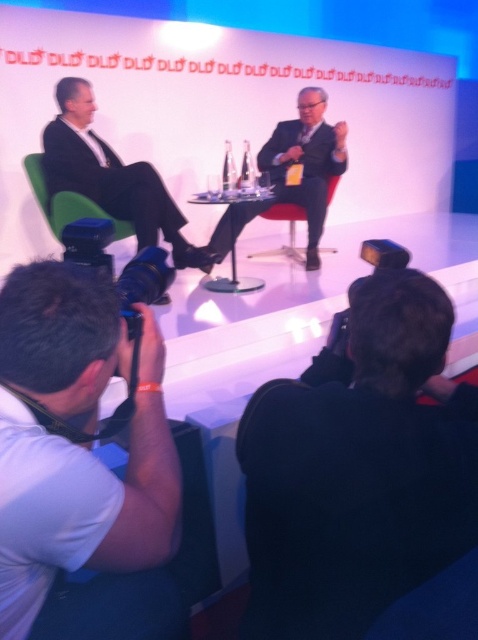
Is matte black suit at left bigger than red leather chair at center?

Correct, matte black suit at left is larger in size than red leather chair at center.

Between point (175, 225) and point (323, 250), which one is positioned in front?

Positioned in front is point (175, 225).

Does point (170, 240) come behind point (304, 260)?

No, it is in front of (304, 260).

I want to click on matte black suit at left, so click(x=111, y=177).

Between point (36, 353) and point (115, 240), which one is positioned behind?

Positioned behind is point (115, 240).

Who is taller, white fabric camera at lower left or green fabric chair at left?

white fabric camera at lower left is taller.

Who is more forward, (43, 460) or (126, 234)?

Positioned in front is point (43, 460).

At what (x,y) coordinates should I click in order to perform the action: click on white fabric camera at lower left. Please return your answer as a coordinate pair (x, y). This screenshot has width=478, height=640. Looking at the image, I should click on point(90,522).

What do you see at coordinates (143, 282) in the screenshot?
I see `blue plastic camera at lower left` at bounding box center [143, 282].

Does blue plastic camera at lower left appear on the left side of red leather chair at center?

Correct, you'll find blue plastic camera at lower left to the left of red leather chair at center.

Find the location of a particular element. This screenshot has width=478, height=640. blue plastic camera at lower left is located at coordinates (143, 282).

This screenshot has width=478, height=640. I want to click on blue plastic camera at lower left, so click(143, 282).